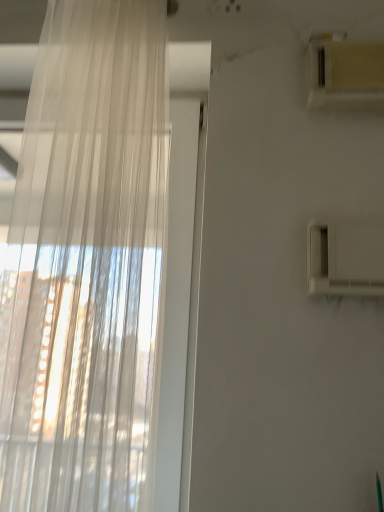
Question: Considering the positions of translucent fabric curtain at left and white plastic air conditioning unit at upper right in the image, is translucent fabric curtain at left bigger or smaller than white plastic air conditioning unit at upper right?

Choices:
 (A) small
 (B) big

Answer: (B)

Question: Is translucent fabric curtain at left taller or shorter than white plastic air conditioning unit at upper right?

Choices:
 (A) short
 (B) tall

Answer: (B)

Question: Is point (72, 64) positioned closer to the camera than point (372, 60)?

Choices:
 (A) farther
 (B) closer

Answer: (B)

Question: Is point (311, 51) closer or farther from the camera than point (64, 364)?

Choices:
 (A) farther
 (B) closer

Answer: (A)

Question: Is white plastic air conditioning unit at upper right in front of or behind translucent fabric curtain at left in the image?

Choices:
 (A) front
 (B) behind

Answer: (B)

Question: From a real-world perspective, relative to translucent fabric curtain at left, is white plastic air conditioning unit at upper right vertically above or below?

Choices:
 (A) above
 (B) below

Answer: (A)

Question: Is white plastic air conditioning unit at upper right to the left or to the right of translucent fabric curtain at left in the image?

Choices:
 (A) right
 (B) left

Answer: (A)